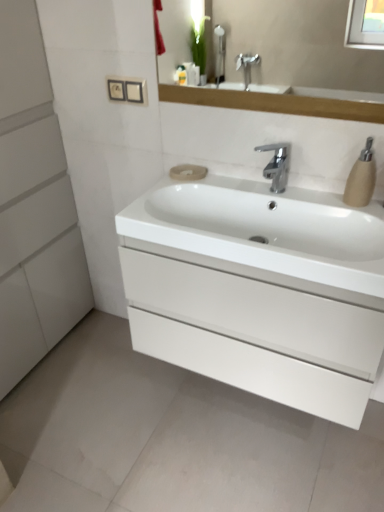
Identify the location of free space to the right of beige matte soap at center. (233, 177).